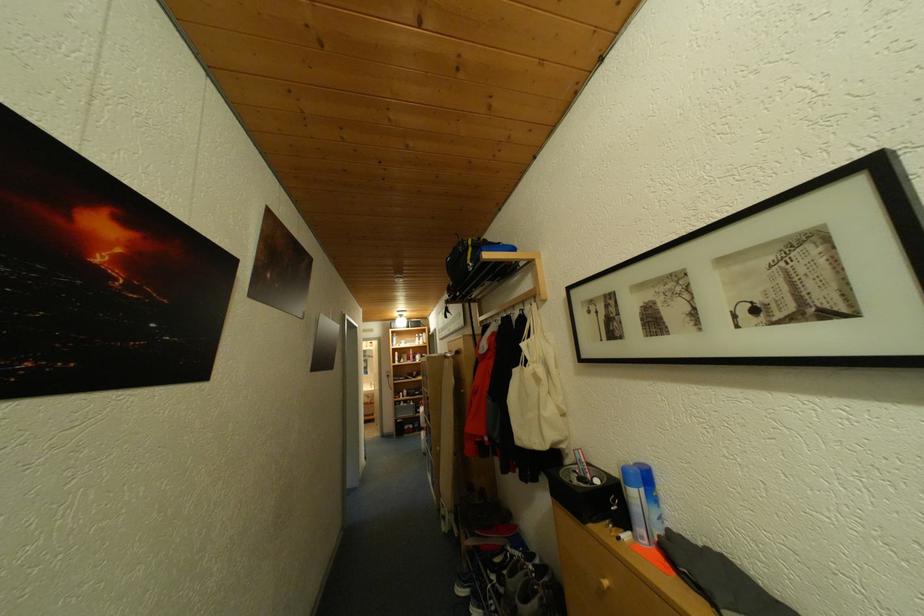
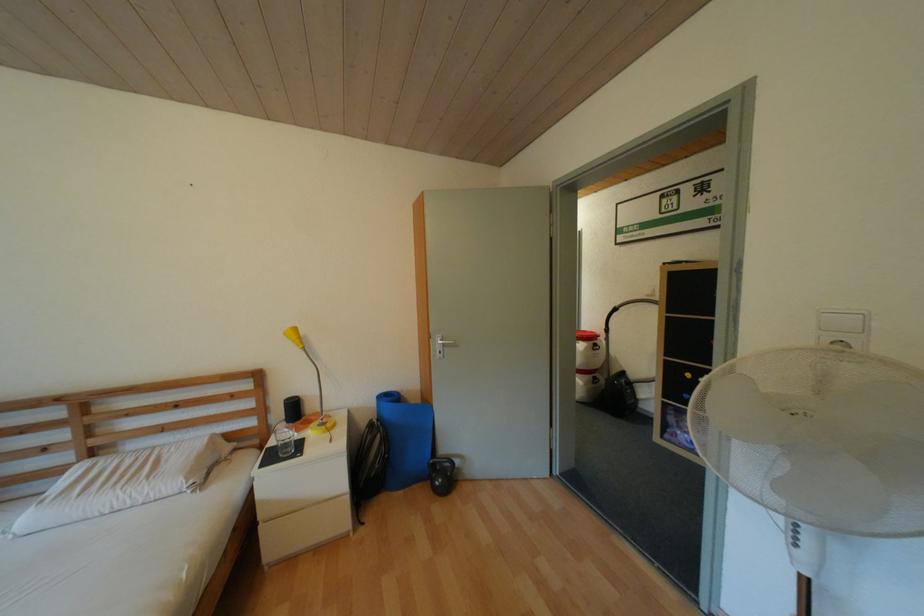
The images are taken continuously from a first-person perspective. In which direction are you moving?

The movement direction of the cameraman is left, forward.